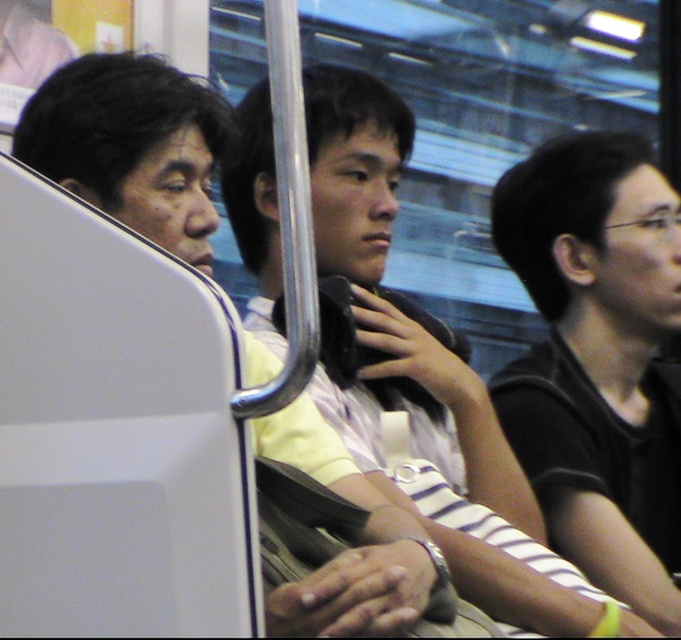
Is black matte shirt at right bigger than matte black headphones at center?

No, black matte shirt at right is not bigger than matte black headphones at center.

Does black matte shirt at right lie in front of matte black headphones at center?

No.

The width and height of the screenshot is (681, 640). In order to click on black matte shirt at right in this screenshot , I will do `click(599, 358)`.

At what (x,y) coordinates should I click in order to perform the action: click on black matte shirt at right. Please return your answer as a coordinate pair (x, y). The height and width of the screenshot is (640, 681). Looking at the image, I should click on (599, 358).

Between point (439, 484) and point (104, 97), which one is positioned in front?

Positioned in front is point (104, 97).

Is point (424, 513) behind point (270, 444)?

Yes, it is.

In order to click on matte black headphones at center in this screenshot , I will do `click(424, 376)`.

Can you confirm if black matte shirt at right is shorter than matte black bag at center?

No, black matte shirt at right is not shorter than matte black bag at center.

Does black matte shirt at right have a larger size compared to matte black bag at center?

Incorrect, black matte shirt at right is not larger than matte black bag at center.

The height and width of the screenshot is (640, 681). Find the location of `black matte shirt at right`. black matte shirt at right is located at coordinates (599, 358).

What are the coordinates of `black matte shirt at right` in the screenshot? It's located at (599, 358).